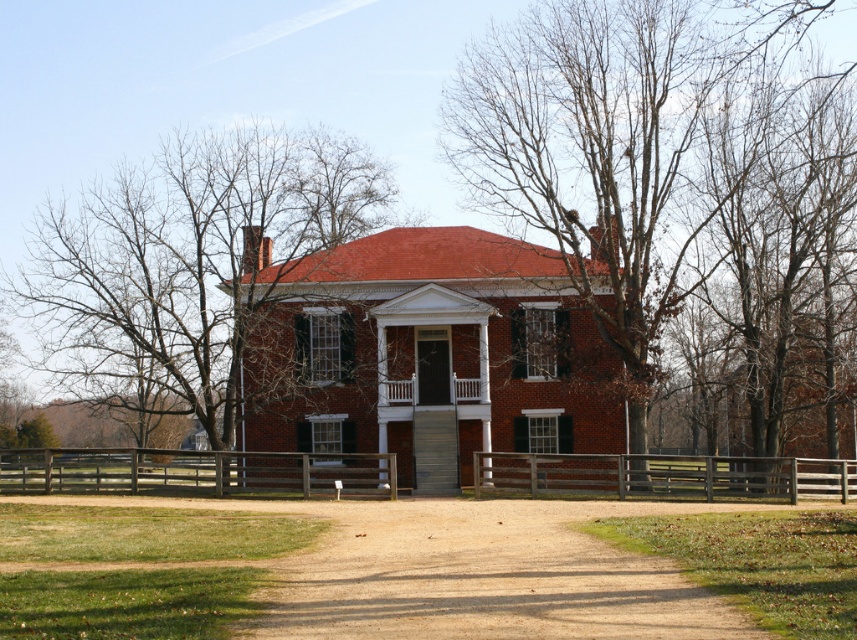
Question: Which point is closer to the camera taking this photo?

Choices:
 (A) (136, 228)
 (B) (712, 480)

Answer: (B)

Question: From the image, what is the correct spatial relationship of bare branches at upper center in relation to bare branches at center?

Choices:
 (A) right
 (B) left

Answer: (A)

Question: Among these points, which one is farthest from the camera?

Choices:
 (A) (487, 461)
 (B) (13, 486)
 (C) (91, 452)

Answer: (A)

Question: Estimate the real-world distances between objects in this image. Which object is closer to the brown wooden fence at center?

Choices:
 (A) brown wooden fence at lower center
 (B) bare branches at upper center

Answer: (B)

Question: Can you confirm if bare branches at upper center is positioned below brown wooden fence at lower center?

Choices:
 (A) no
 (B) yes

Answer: (A)

Question: Is bare branches at center smaller than brown wooden fence at center?

Choices:
 (A) no
 (B) yes

Answer: (A)